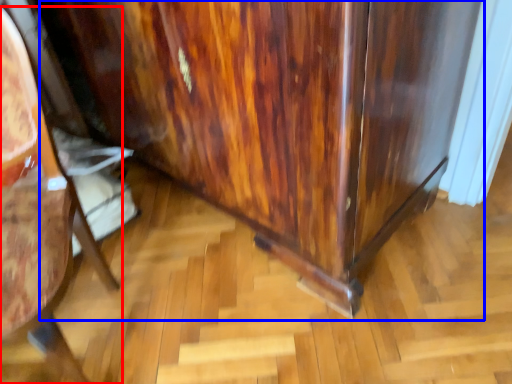
Question: Which object appears closest to the camera in this image, furniture (highlighted by a red box) or dresser (highlighted by a blue box)?

Choices:
 (A) furniture
 (B) dresser

Answer: (A)